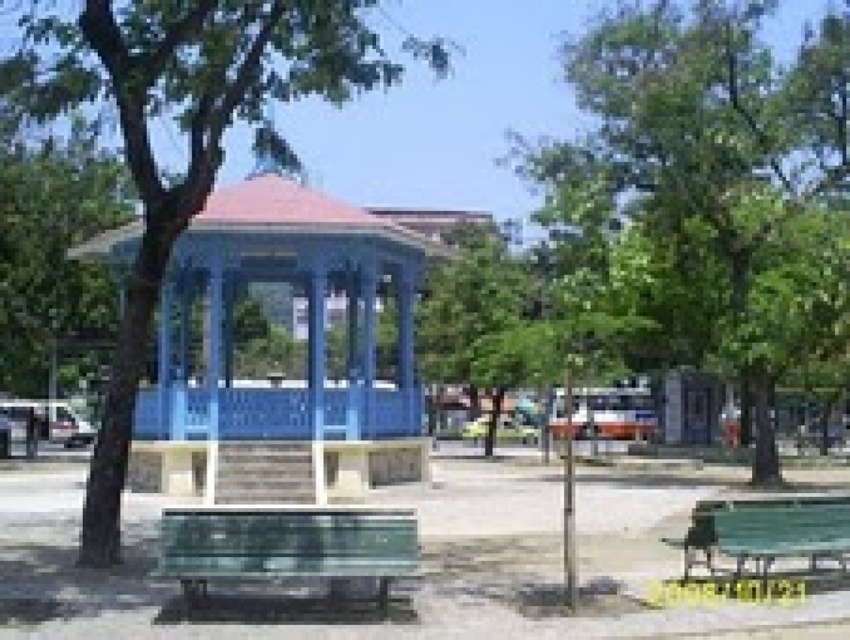
You are sitting on the green plastic bench at lower right and want to look at the green wood tree at center. In which direction should you turn your head?

The green wood tree at center is to the left of the green plastic bench at lower right, so you should turn your head to the left to look at it.

You are sitting on a bench in the park and notice two trees at the center of the image. Which tree, the green leafy tree at center or the green wood tree at center, is positioned to the right of the other?

The green leafy tree at center is positioned to the right of the green wood tree at center.

You are planning to place a new bench in the park. The existing green plastic bench at lower right is smaller than the green wood tree at center. Which object should you consider the size of when deciding where to place the new bench?

You should consider the size of the green wood tree at center because it is larger than the green plastic bench at lower right, so the new bench should be placed in an area that accommodates its size.